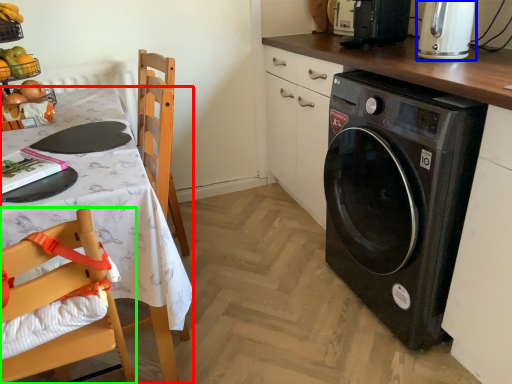
Question: Estimate the real-world distances between objects in this image. Which object is farther from desk (highlighted by a red box), kitchen appliance (highlighted by a blue box) or chair (highlighted by a green box)?

Choices:
 (A) kitchen appliance
 (B) chair

Answer: (A)